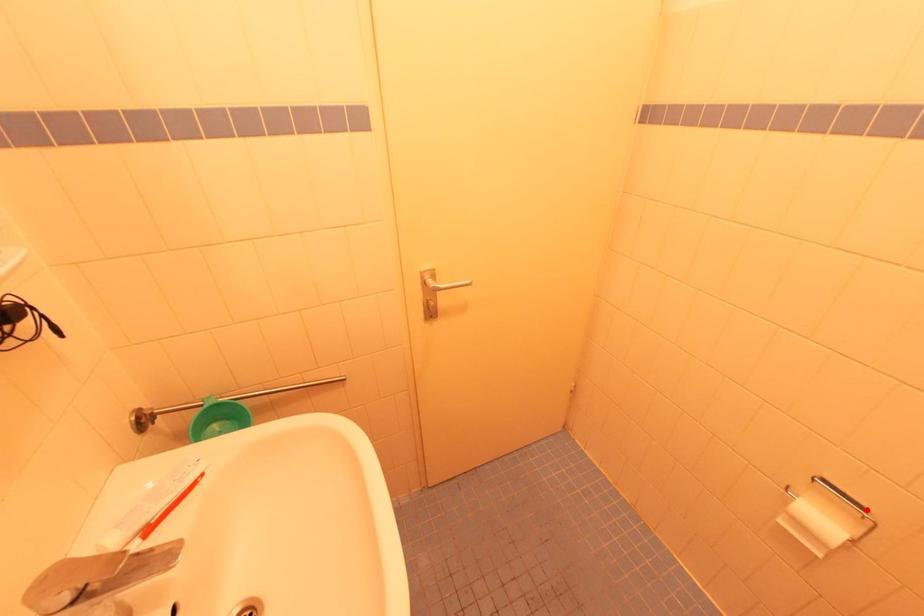
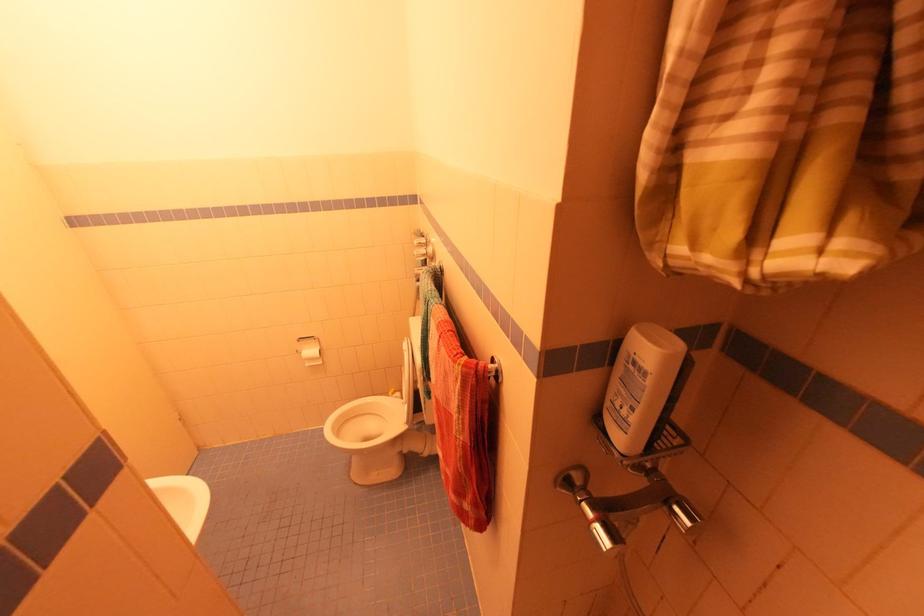
Question: A red point is marked in image1. In image2, is the corresponding 3D point closer to the camera or farther? Reply with the corresponding letter.

Choices:
 (A) The corresponding 3D point is closer.
 (B) The corresponding 3D point is farther.

Answer: (A)